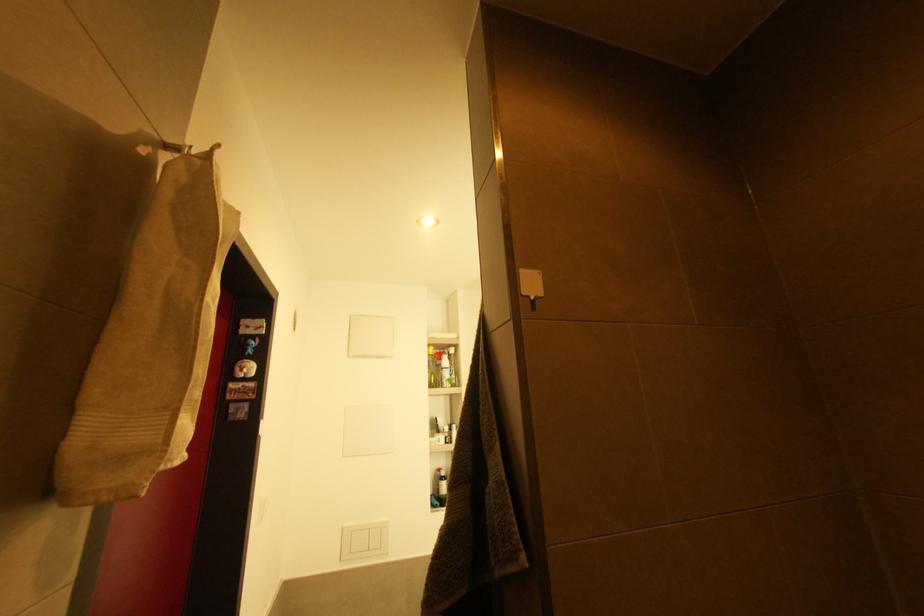
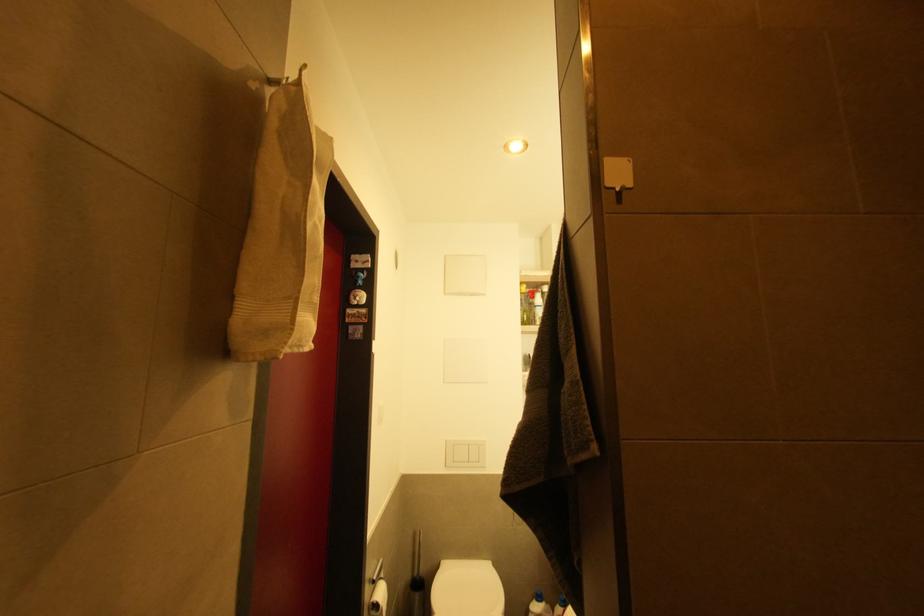
Question: How did the camera likely rotate?

Choices:
 (A) Left
 (B) Right
 (C) Up
 (D) Down

Answer: (A)